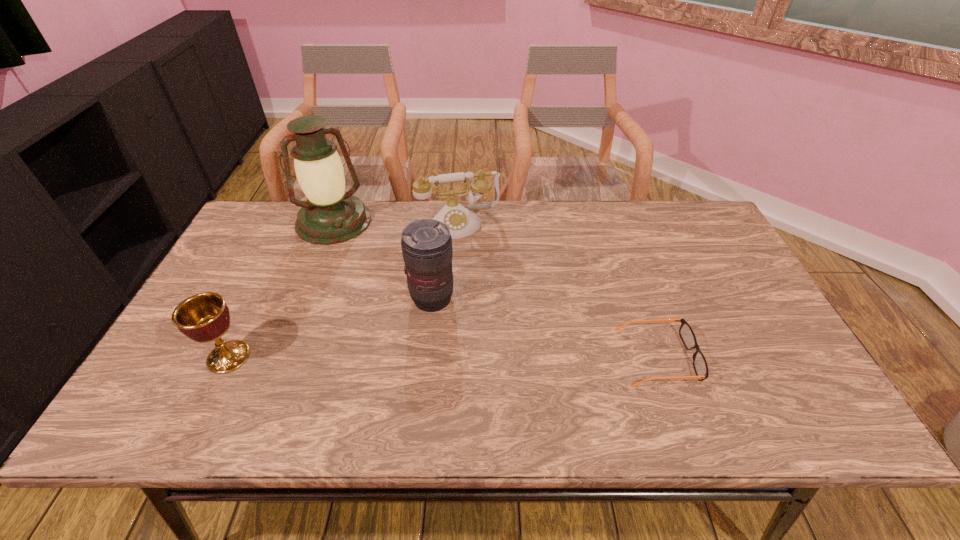
At what (x,y) coordinates should I click in order to perform the action: click on free area in between the second tallest object and the lantern. Please return your answer as a coordinate pair (x, y). Looking at the image, I should click on (383, 260).

The image size is (960, 540). I want to click on object that stands as the fourth closest to the lantern, so click(x=686, y=333).

Identify the location of object that ranks as the fourth closest to the tallest object. (686, 333).

Where is `vacant position in the image that satisfies the following two spatial constraints: 1. on the front side of the fourth shortest object; 2. on the right side of the lantern`? vacant position in the image that satisfies the following two spatial constraints: 1. on the front side of the fourth shortest object; 2. on the right side of the lantern is located at coordinates (303, 299).